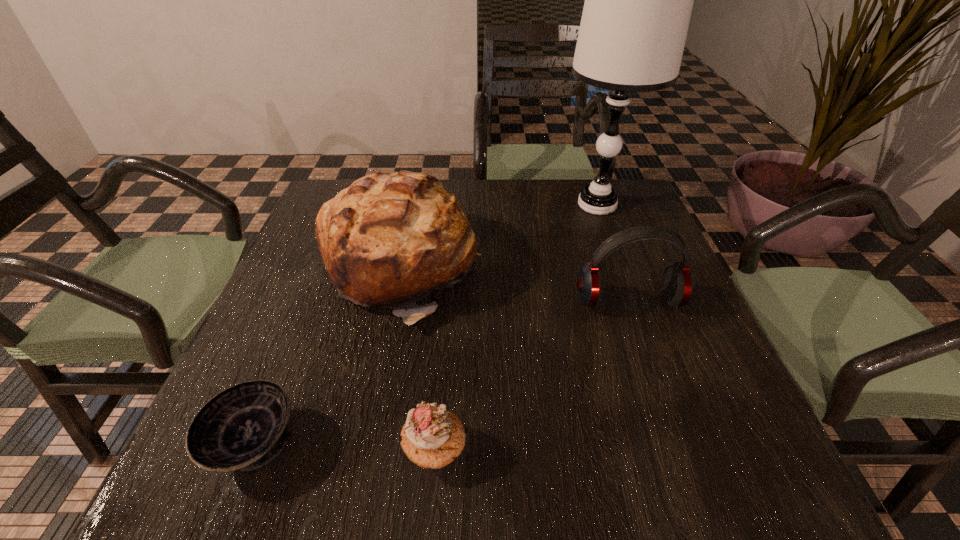
At what (x,y) coordinates should I click in order to perform the action: click on table lamp at the far edge. Please return your answer as a coordinate pair (x, y). The height and width of the screenshot is (540, 960). Looking at the image, I should click on (638, 2).

This screenshot has height=540, width=960. Identify the location of bread positioned at the far edge. pos(388,240).

Image resolution: width=960 pixels, height=540 pixels. Identify the location of cupcake that is at the near edge. (432, 437).

Where is `bowl at the near edge`? The width and height of the screenshot is (960, 540). bowl at the near edge is located at coordinates (243, 428).

The image size is (960, 540). What are the coordinates of `bread present at the left edge` in the screenshot? It's located at (388, 240).

Where is `bowl that is at the left edge`? The image size is (960, 540). bowl that is at the left edge is located at coordinates (243, 428).

Find the location of `table lamp situated at the right edge`. table lamp situated at the right edge is located at coordinates (638, 2).

Where is `earphone located at the right edge`? This screenshot has height=540, width=960. earphone located at the right edge is located at coordinates (677, 282).

I want to click on object present at the far left corner, so click(388, 240).

The height and width of the screenshot is (540, 960). What are the coordinates of `object positioned at the near left corner` in the screenshot? It's located at (243, 428).